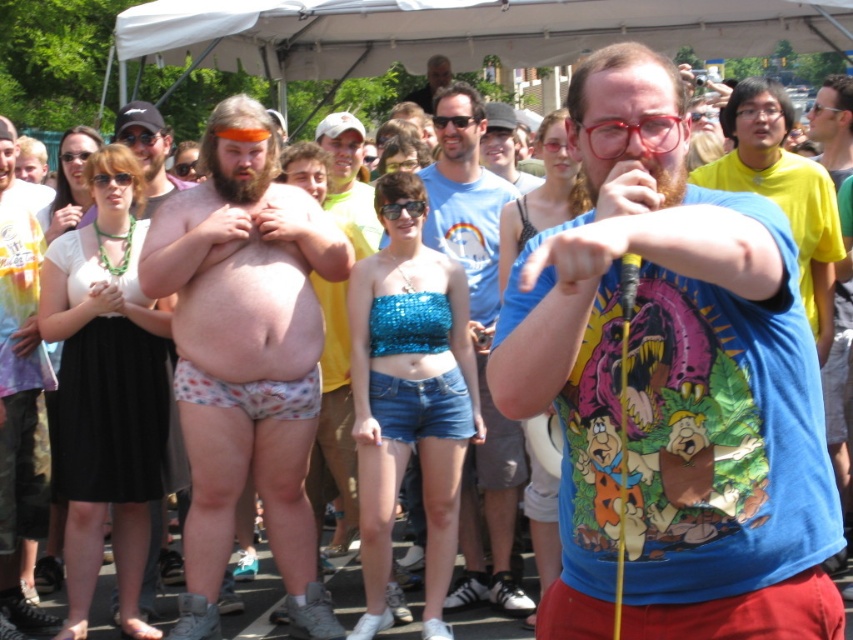
Which is in front, point (223, 419) or point (723, 161)?

Point (223, 419) is more forward.

Which is more to the left, printed cotton shorts at center or yellow t-shirt at upper right?

From the viewer's perspective, printed cotton shorts at center appears more on the left side.

You are a GUI agent. You are given a task and a screenshot of the screen. Output one action in this format:
    pyautogui.click(x=<x>, y=<y>)
    Task: Click on the printed cotton shorts at center
    
    Given the screenshot: What is the action you would take?
    pyautogui.click(x=247, y=356)

Image resolution: width=853 pixels, height=640 pixels. Describe the element at coordinates (476, 340) in the screenshot. I see `blue t-shirt at center` at that location.

Is point (434, 106) behind point (218, 392)?

Yes, point (434, 106) is farther from viewer.

Where is `blue t-shirt at center`? blue t-shirt at center is located at coordinates (476, 340).

Is blue cotton t-shirt at center to the left of floral-patterned fabric underwear at center from the viewer's perspective?

Incorrect, blue cotton t-shirt at center is not on the left side of floral-patterned fabric underwear at center.

Does blue cotton t-shirt at center have a greater height compared to floral-patterned fabric underwear at center?

Indeed, blue cotton t-shirt at center has a greater height compared to floral-patterned fabric underwear at center.

What do you see at coordinates (672, 385) in the screenshot?
I see `blue cotton t-shirt at center` at bounding box center [672, 385].

Locate an element on the screen. The image size is (853, 640). blue cotton t-shirt at center is located at coordinates (672, 385).